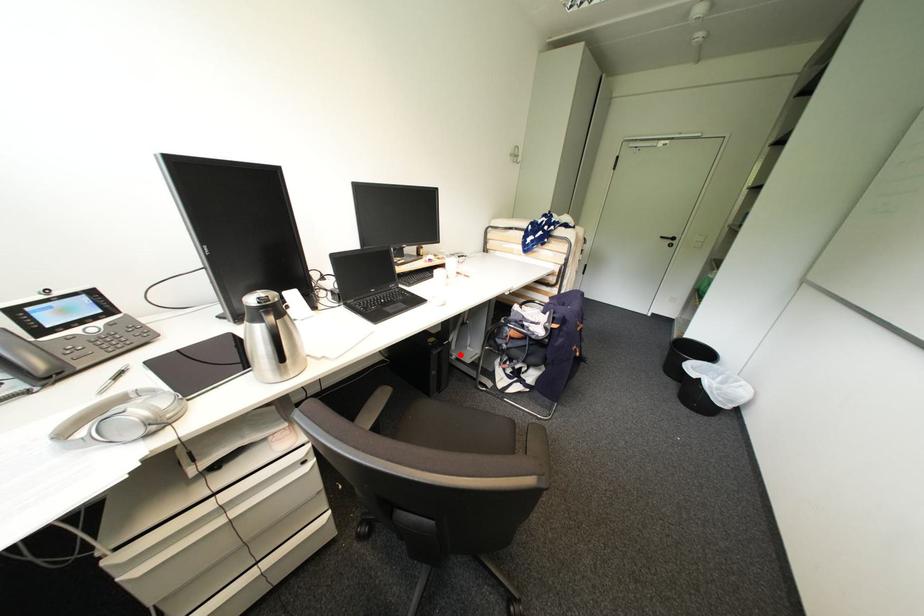
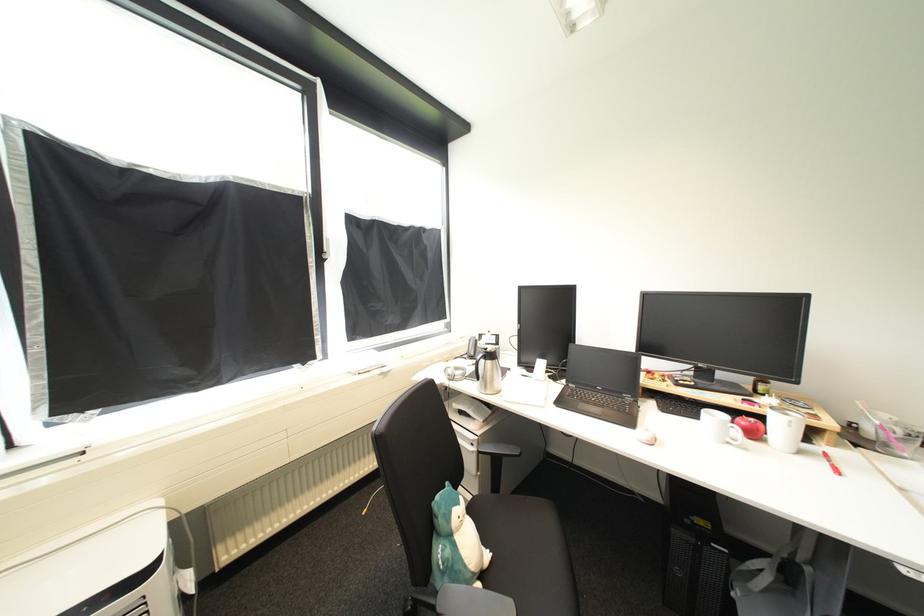
Locate, in the second image, the point that corresponds to the highlighted location in the first image.

(745, 591)